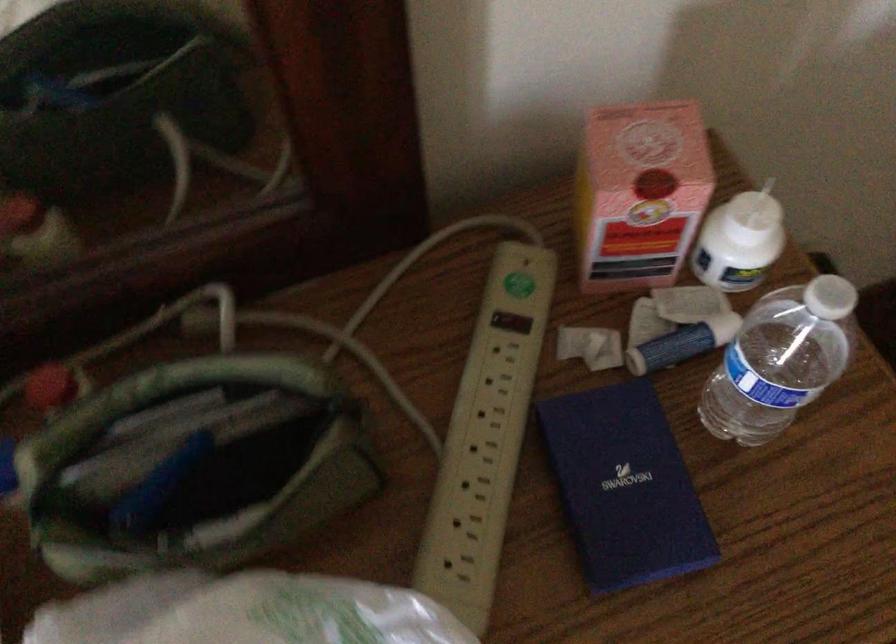
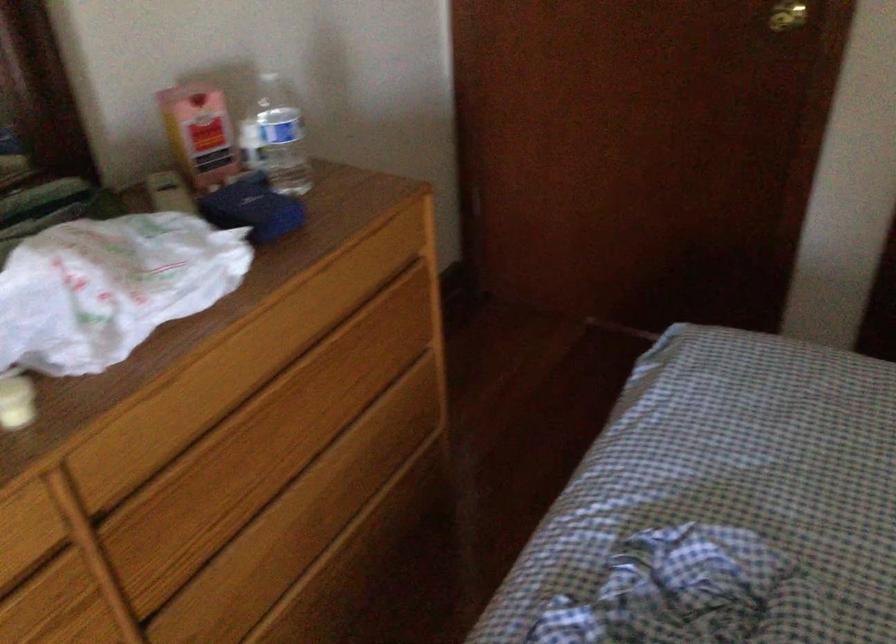
Based on the continuous images, in which direction is the camera rotating?

The camera's rotation is toward right-up.